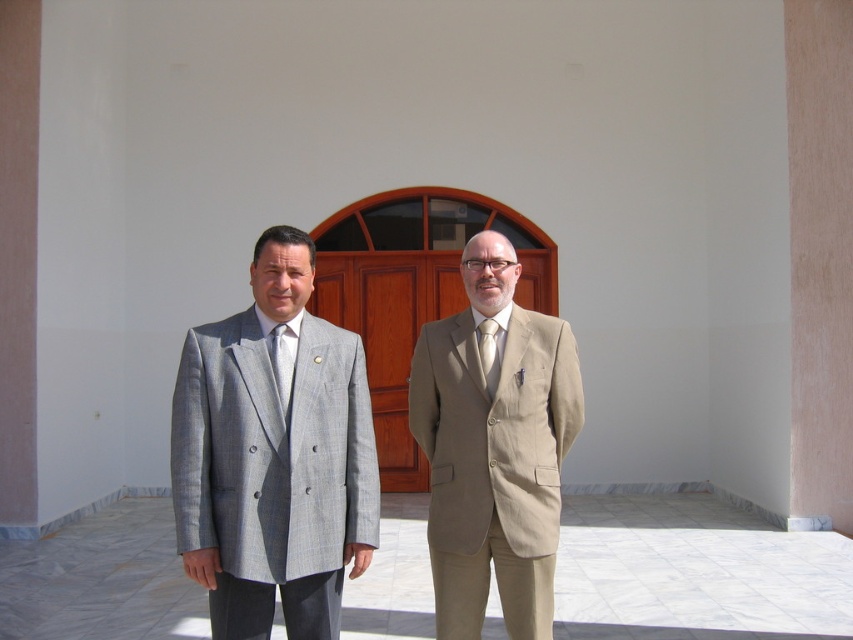
Can you confirm if gray textured suit at left is positioned above matte white tie at center?

Incorrect, gray textured suit at left is not positioned above matte white tie at center.

What do you see at coordinates (273, 456) in the screenshot? I see `gray textured suit at left` at bounding box center [273, 456].

Locate an element on the screen. The height and width of the screenshot is (640, 853). gray textured suit at left is located at coordinates (273, 456).

Does gray textured suit at left appear on the right side of matte gray tie at center?

No, gray textured suit at left is not to the right of matte gray tie at center.

Is gray textured suit at left wider than matte gray tie at center?

Indeed, gray textured suit at left has a greater width compared to matte gray tie at center.

The height and width of the screenshot is (640, 853). I want to click on gray textured suit at left, so tap(273, 456).

Identify the location of gray textured suit at left. (273, 456).

Is gray textured suit at left to the right of beige fabric suit at center from the viewer's perspective?

In fact, gray textured suit at left is to the left of beige fabric suit at center.

Measure the distance between point (254, 614) and camera.

The distance of point (254, 614) from camera is 11.13 feet.

I want to click on gray textured suit at left, so click(x=273, y=456).